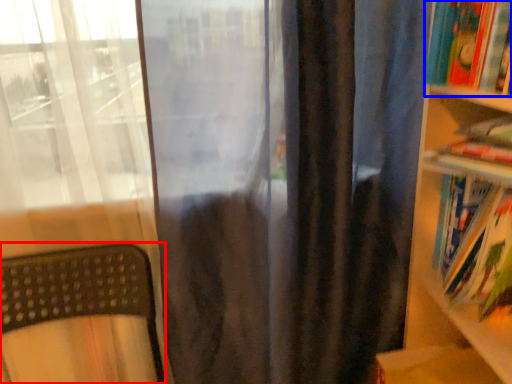
Question: Which object appears closest to the camera in this image, furniture (highlighted by a red box) or book (highlighted by a blue box)?

Choices:
 (A) furniture
 (B) book

Answer: (A)